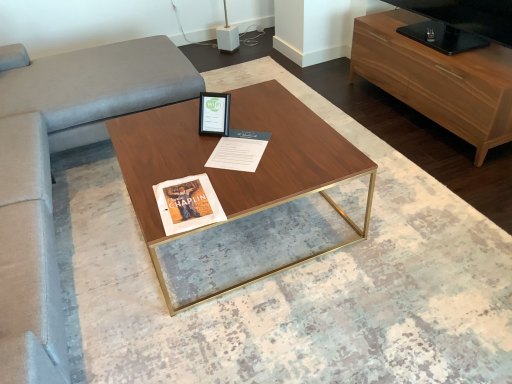
Question: Can you confirm if wooden cabinet at right is positioned to the right of velvet couch at left?

Choices:
 (A) no
 (B) yes

Answer: (B)

Question: Does wooden cabinet at right appear on the left side of velvet couch at left?

Choices:
 (A) yes
 (B) no

Answer: (B)

Question: From the image's perspective, does wooden cabinet at right appear higher than velvet couch at left?

Choices:
 (A) no
 (B) yes

Answer: (A)

Question: Can you confirm if wooden cabinet at right is smaller than velvet couch at left?

Choices:
 (A) no
 (B) yes

Answer: (B)

Question: Is the position of wooden cabinet at right less distant than that of velvet couch at left?

Choices:
 (A) no
 (B) yes

Answer: (A)

Question: Considering the relative sizes of wooden cabinet at right and velvet couch at left in the image provided, is wooden cabinet at right wider than velvet couch at left?

Choices:
 (A) no
 (B) yes

Answer: (A)

Question: Considering the relative sizes of walnut wood coffee table at center and white paper at center in the image provided, is walnut wood coffee table at center shorter than white paper at center?

Choices:
 (A) no
 (B) yes

Answer: (A)

Question: From a real-world perspective, is walnut wood coffee table at center located beneath white paper at center?

Choices:
 (A) yes
 (B) no

Answer: (A)

Question: Does walnut wood coffee table at center lie in front of white paper at center?

Choices:
 (A) yes
 (B) no

Answer: (A)

Question: From the image's perspective, is walnut wood coffee table at center beneath white paper at center?

Choices:
 (A) no
 (B) yes

Answer: (B)

Question: Considering the relative sizes of walnut wood coffee table at center and white paper at center in the image provided, is walnut wood coffee table at center taller than white paper at center?

Choices:
 (A) yes
 (B) no

Answer: (A)

Question: From the image's perspective, is walnut wood coffee table at center over white paper at center?

Choices:
 (A) no
 (B) yes

Answer: (A)

Question: Is matte black picture frame at center not near wooden cabinet at right?

Choices:
 (A) no
 (B) yes

Answer: (B)